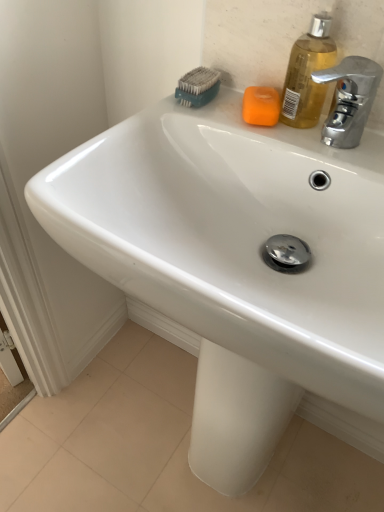
Question: From a real-world perspective, is orange matte soap at upper center on top of translucent yellow liquid at upper right?

Choices:
 (A) no
 (B) yes

Answer: (A)

Question: Is translucent yellow liquid at upper right a part of orange matte soap at upper center?

Choices:
 (A) yes
 (B) no

Answer: (B)

Question: Does orange matte soap at upper center have a greater width compared to translucent yellow liquid at upper right?

Choices:
 (A) no
 (B) yes

Answer: (B)

Question: Considering the relative positions of orange matte soap at upper center and translucent yellow liquid at upper right in the image provided, is orange matte soap at upper center to the right of translucent yellow liquid at upper right from the viewer's perspective?

Choices:
 (A) no
 (B) yes

Answer: (A)

Question: From the image's perspective, would you say orange matte soap at upper center is shown under translucent yellow liquid at upper right?

Choices:
 (A) no
 (B) yes

Answer: (B)

Question: Is orange matte soap at upper center smaller than translucent yellow liquid at upper right?

Choices:
 (A) no
 (B) yes

Answer: (B)

Question: Would you consider orange matte soap at upper center to be distant from teal plastic brush at upper center?

Choices:
 (A) yes
 (B) no

Answer: (B)

Question: Can you confirm if orange matte soap at upper center is taller than teal plastic brush at upper center?

Choices:
 (A) no
 (B) yes

Answer: (A)

Question: Is orange matte soap at upper center positioned in front of teal plastic brush at upper center?

Choices:
 (A) yes
 (B) no

Answer: (A)

Question: From the image's perspective, would you say orange matte soap at upper center is shown under teal plastic brush at upper center?

Choices:
 (A) no
 (B) yes

Answer: (B)

Question: Could teal plastic brush at upper center be considered to be inside orange matte soap at upper center?

Choices:
 (A) yes
 (B) no

Answer: (B)

Question: Is orange matte soap at upper center looking in the opposite direction of teal plastic brush at upper center?

Choices:
 (A) yes
 (B) no

Answer: (B)

Question: Is the position of teal plastic brush at upper center more distant than that of orange matte soap at upper center?

Choices:
 (A) yes
 (B) no

Answer: (A)